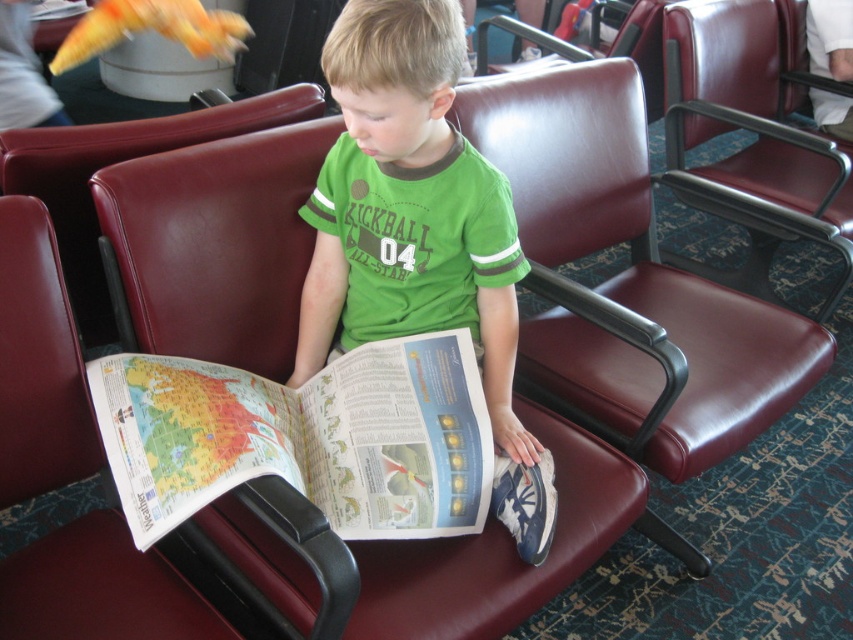
You are a person trying to sit down in the waiting area. There are two chairs available here. One is the maroon leather armchair at center and the other is the maroon leather chair at center. Which chair can you sit on if the one below is already occupied?

The maroon leather armchair at center is positioned over maroon leather chair at center, so if the lower chair is occupied, you can sit on the maroon leather armchair at center.

The boy is sitting on the maroon leather chair at center and looking at the printed paper map at center. Which object is positioned to the right of the other?

The printed paper map at center is to the right of the maroon leather chair at center.

In the scene shown: You are a photographer taking a picture of the scene. You want to ensure the green jersey at center and the maroon leather chair at center are both clearly visible. Based on their positions, which object should you focus on first to capture both in sharp focus?

The green jersey at center is in front of the maroon leather chair at center, so you should focus on the green jersey at center first to ensure both are in sharp focus.